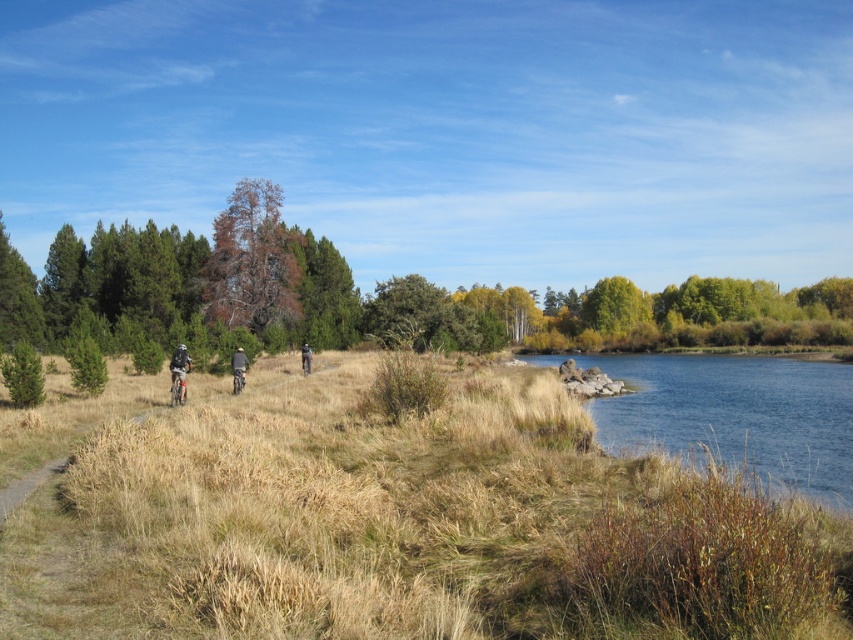
Is brown textured tree at center bigger than matte black bicycle at center-left?

Yes, brown textured tree at center is bigger than matte black bicycle at center-left.

Is brown textured tree at center shorter than matte black bicycle at center-left?

No, brown textured tree at center is not shorter than matte black bicycle at center-left.

Describe the element at coordinates (251, 260) in the screenshot. The image size is (853, 640). I see `brown textured tree at center` at that location.

Locate an element on the screen. brown textured tree at center is located at coordinates (251, 260).

What are the coordinates of `brown textured tree at center` in the screenshot? It's located at (251, 260).

Can you confirm if brown textured tree at center is bigger than green matte pine at left?

Yes, brown textured tree at center is bigger than green matte pine at left.

Which is behind, point (218, 304) or point (22, 348)?

The point (218, 304) is more distant.

Locate an element on the screen. This screenshot has width=853, height=640. brown textured tree at center is located at coordinates (251, 260).

Does brown/dried wood tree at center have a larger size compared to green matte pine at left?

Yes.

Which is above, brown/dried wood tree at center or green matte pine at left?

Positioned higher is brown/dried wood tree at center.

Where is `brown/dried wood tree at center`? brown/dried wood tree at center is located at coordinates (186, 280).

At what (x,y) coordinates should I click in order to perform the action: click on brown/dried wood tree at center. Please return your answer as a coordinate pair (x, y). The width and height of the screenshot is (853, 640). Looking at the image, I should click on (186, 280).